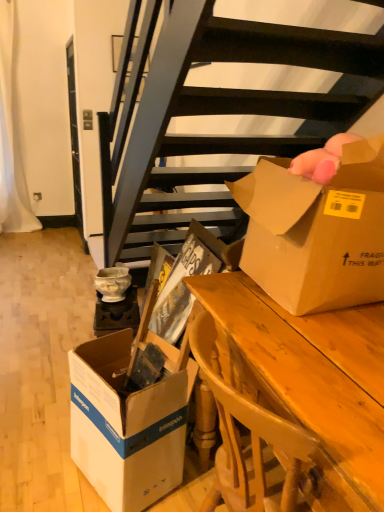
Question: From a real-world perspective, is white cardboard box at lower left, positioned as the 2th box in top-to-bottom order, beneath wooden desk at center?

Choices:
 (A) yes
 (B) no

Answer: (A)

Question: From the image's perspective, is white cardboard box at lower left, positioned as the 2th box in top-to-bottom order, beneath wooden desk at center?

Choices:
 (A) no
 (B) yes

Answer: (B)

Question: Can you confirm if white cardboard box at lower left, marked as the 1th box in a left-to-right arrangement, is positioned to the left of wooden desk at center?

Choices:
 (A) no
 (B) yes

Answer: (B)

Question: From the image's perspective, is white cardboard box at lower left, positioned as the 2th box in top-to-bottom order, above wooden desk at center?

Choices:
 (A) yes
 (B) no

Answer: (B)

Question: Is white cardboard box at lower left, positioned as the 2th box in top-to-bottom order, positioned with its back to wooden desk at center?

Choices:
 (A) no
 (B) yes

Answer: (B)

Question: Considering the relative positions of white cardboard box at lower left, positioned as the 1th box in bottom-to-top order, and wooden desk at center in the image provided, is white cardboard box at lower left, positioned as the 1th box in bottom-to-top order, to the right of wooden desk at center from the viewer's perspective?

Choices:
 (A) yes
 (B) no

Answer: (B)

Question: Is white cardboard box at lower left, marked as the 1th box in a left-to-right arrangement, shorter than cardboard box at center?

Choices:
 (A) yes
 (B) no

Answer: (A)

Question: Does white cardboard box at lower left, marked as the 1th box in a left-to-right arrangement, have a larger size compared to cardboard box at center?

Choices:
 (A) no
 (B) yes

Answer: (A)

Question: Is cardboard box at center surrounded by white cardboard box at lower left, positioned as the 1th box in bottom-to-top order?

Choices:
 (A) yes
 (B) no

Answer: (B)

Question: From a real-world perspective, is white cardboard box at lower left, positioned as the 2th box in top-to-bottom order, located higher than cardboard box at center?

Choices:
 (A) no
 (B) yes

Answer: (A)

Question: Is white cardboard box at lower left, marked as the 1th box in a left-to-right arrangement, far away from cardboard box at center?

Choices:
 (A) yes
 (B) no

Answer: (B)

Question: Is white cardboard box at lower left, positioned as the 2th box in top-to-bottom order, positioned beyond the bounds of cardboard box at center?

Choices:
 (A) no
 (B) yes

Answer: (B)

Question: Is cardboard box at center not near wooden desk at center?

Choices:
 (A) no
 (B) yes

Answer: (A)